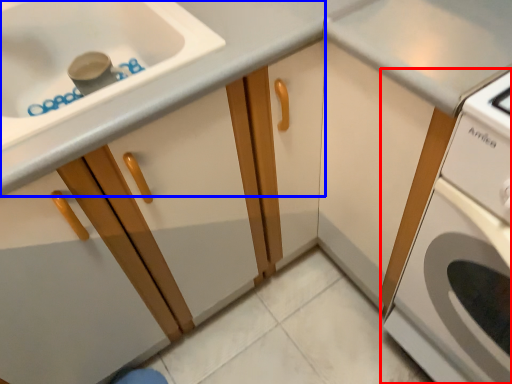
Question: Which point is closer to the camera, home appliance (highlighted by a red box) or cabinetry (highlighted by a blue box)?

Choices:
 (A) home appliance
 (B) cabinetry

Answer: (A)